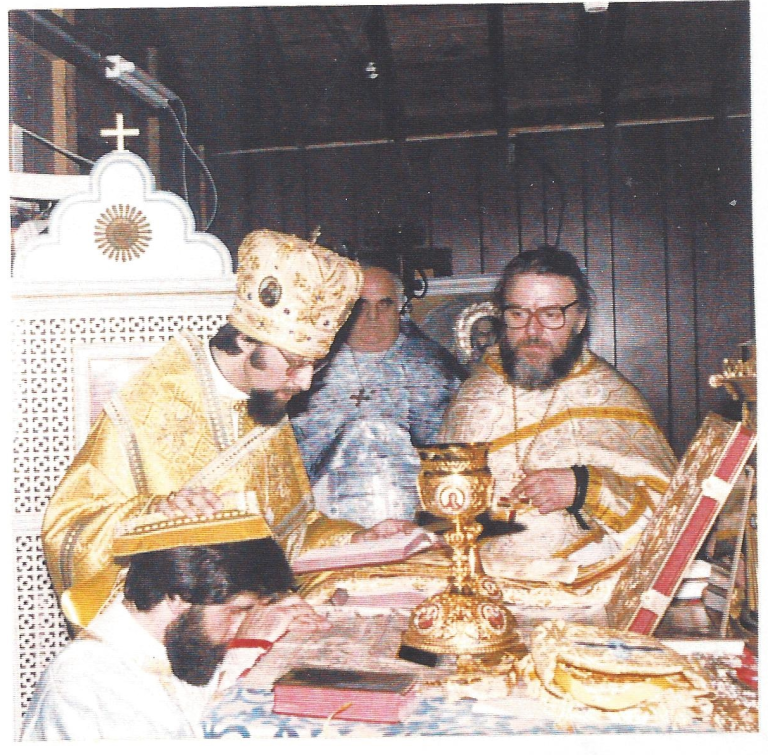
The height and width of the screenshot is (755, 768). What are the coordinates of `books` in the screenshot? It's located at (376, 692), (395, 544), (687, 541).